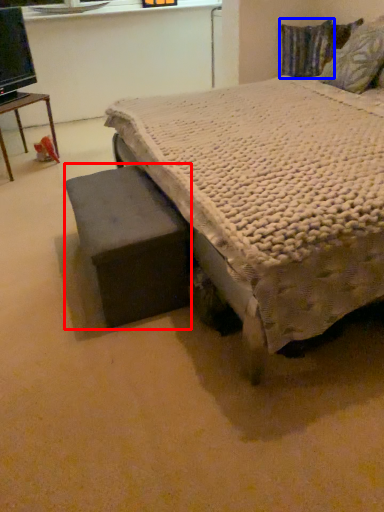
Question: Which point is further to the camera, swivel chair (highlighted by a red box) or pillow (highlighted by a blue box)?

Choices:
 (A) swivel chair
 (B) pillow

Answer: (B)